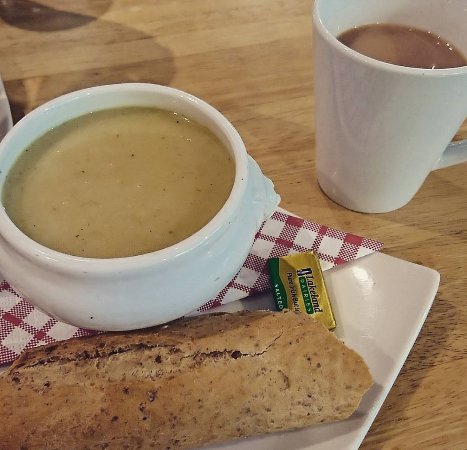
Where is `bowl`? This screenshot has width=467, height=450. bowl is located at coordinates (78, 294).